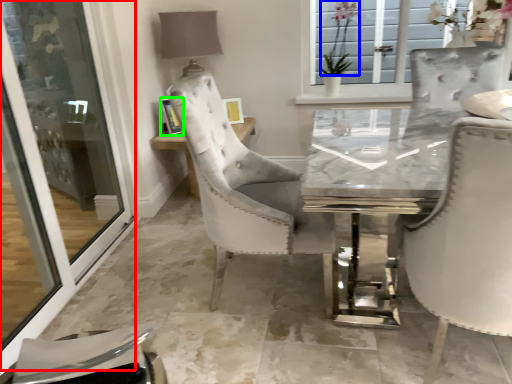
Question: Which is farther away from screen door (highlighted by a red box)? flower (highlighted by a blue box) or picture frame (highlighted by a green box)?

Choices:
 (A) flower
 (B) picture frame

Answer: (A)